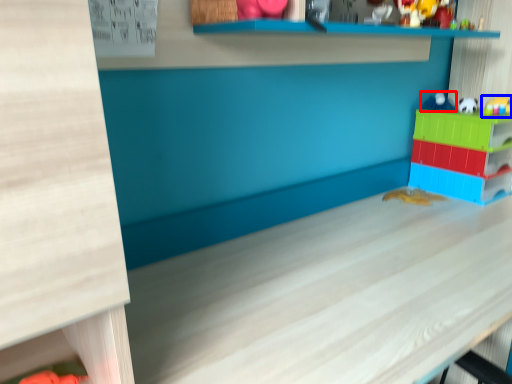
Question: Which object appears closest to the camera in this image, toy (highlighted by a red box) or toy (highlighted by a blue box)?

Choices:
 (A) toy
 (B) toy

Answer: (B)